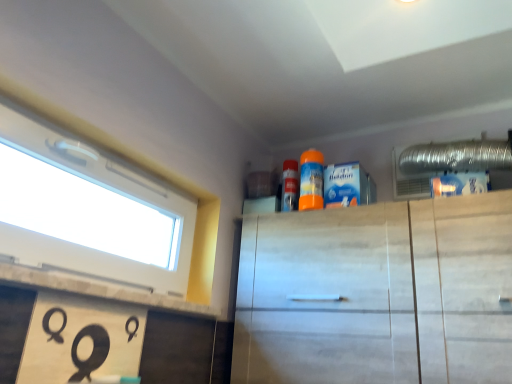
I want to click on vacant area on top of white plastic window at upper left (from a real-world perspective), so [x=102, y=153].